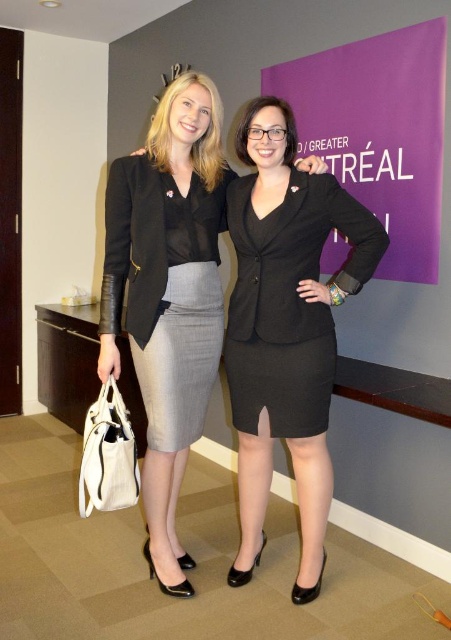
You are a photographer setting up for a group photo. You need to ensure that the purple matte bulletin board at upper right and the gray textured skirt at center are both in focus. The camera you are using has a depth of field that can cover objects within a 1.2 meters range. Can both objects be in focus at the same time?

The purple matte bulletin board at upper right is 1.09 meters from the gray textured skirt at center. Since the distance between them is less than the camera depth of field range of 1.2 meters, both objects can be in focus simultaneously.

You are a fashion designer observing two outfits in the image. The first is the black matte dress at center, and the second is the gray textured skirt at center. Which of these two outfits is larger in size?

The black matte dress at center is bigger than the gray textured skirt at center, so the black matte dress at center is larger in size.

You are a photographer setting up for a photoshoot. You need to ensure that the black matte dress at center and the gray textured skirt at center are both visible in the frame. Based on their positions, which one should you focus on first to capture both in the shot?

The black matte dress at center is located below the gray textured skirt at center, so you should focus on the gray textured skirt at center first to ensure both are in the frame.